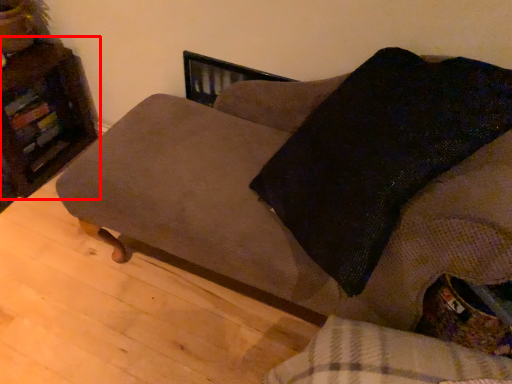
Question: In this image, where is furniture (annotated by the red box) located relative to studio couch?

Choices:
 (A) right
 (B) left

Answer: (B)